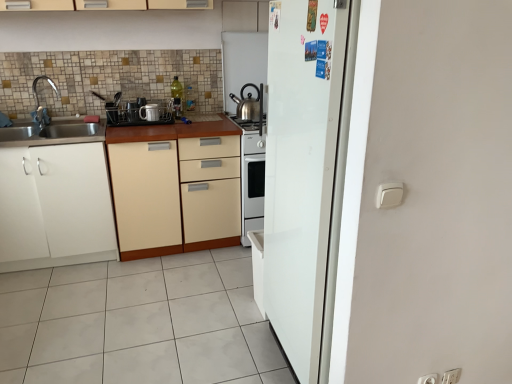
Question: Does stainless steel kettle at center, which ranks as the first appliance in right-to-left order, come behind metallic dish rack at center, acting as the third appliance starting from the right?

Choices:
 (A) yes
 (B) no

Answer: (A)

Question: From a real-world perspective, is stainless steel kettle at center, which is the 3th appliance in left-to-right order, beneath metallic dish rack at center, the 1th appliance positioned from the left?

Choices:
 (A) yes
 (B) no

Answer: (B)

Question: Is stainless steel kettle at center, which ranks as the first appliance in right-to-left order, touching metallic dish rack at center, acting as the third appliance starting from the right?

Choices:
 (A) no
 (B) yes

Answer: (A)

Question: Does stainless steel kettle at center, which ranks as the first appliance in right-to-left order, appear on the right side of metallic dish rack at center, acting as the third appliance starting from the right?

Choices:
 (A) yes
 (B) no

Answer: (A)

Question: From the image's perspective, does stainless steel kettle at center, which is the 3th appliance in left-to-right order, appear lower than metallic dish rack at center, the 1th appliance positioned from the left?

Choices:
 (A) yes
 (B) no

Answer: (B)

Question: Considering the positions of stainless steel kettle at center, which is the 3th appliance in left-to-right order, and white matte cabinet at left, the second cabinetry positioned from the right, in the image, is stainless steel kettle at center, which is the 3th appliance in left-to-right order, wider or thinner than white matte cabinet at left, the second cabinetry positioned from the right,?

Choices:
 (A) thin
 (B) wide

Answer: (A)

Question: Based on their positions, is stainless steel kettle at center, which is the 3th appliance in left-to-right order, located to the left or right of white matte cabinet at left, the second cabinetry positioned from the right?

Choices:
 (A) right
 (B) left

Answer: (A)

Question: Is stainless steel kettle at center, which is the 3th appliance in left-to-right order, inside or outside of white matte cabinet at left, placed as the 1th cabinetry when sorted from left to right?

Choices:
 (A) inside
 (B) outside

Answer: (B)

Question: Considering their positions, is stainless steel kettle at center, which is the 3th appliance in left-to-right order, located in front of or behind white matte cabinet at left, the second cabinetry positioned from the right?

Choices:
 (A) behind
 (B) front

Answer: (A)

Question: In the image, is metallic silver kettle at upper center positioned in front of or behind white plastic electric outlet at lower right, which ranks as the second electric outlet in right-to-left order?

Choices:
 (A) behind
 (B) front

Answer: (A)

Question: Is metallic silver kettle at upper center situated inside white plastic electric outlet at lower right, which ranks as the second electric outlet in right-to-left order, or outside?

Choices:
 (A) outside
 (B) inside

Answer: (A)

Question: Is point (237, 102) closer or farther from the camera than point (429, 374)?

Choices:
 (A) farther
 (B) closer

Answer: (A)

Question: In terms of width, does metallic silver kettle at upper center look wider or thinner when compared to white plastic electric outlet at lower right, the 1th electric outlet from the left?

Choices:
 (A) thin
 (B) wide

Answer: (B)

Question: From a real-world perspective, relative to stainless steel kettle at center, which ranks as the first appliance in right-to-left order, is white matte cabinet at left, placed as the 1th cabinetry when sorted from left to right, vertically above or below?

Choices:
 (A) below
 (B) above

Answer: (A)

Question: From their relative heights in the image, would you say white matte cabinet at left, the second cabinetry positioned from the right, is taller or shorter than stainless steel kettle at center, which ranks as the first appliance in right-to-left order?

Choices:
 (A) short
 (B) tall

Answer: (B)